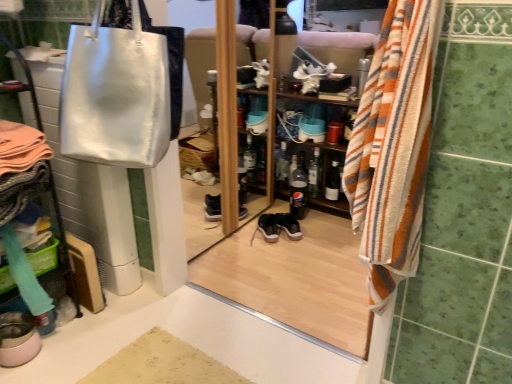
Question: Would you consider shiny silver bag at upper left to be distant from clear glass bottle at center, placed as the fourth bottle when sorted from right to left?

Choices:
 (A) no
 (B) yes

Answer: (B)

Question: Is shiny silver bag at upper left outside clear glass bottle at center, positioned as the 1th bottle in left-to-right order?

Choices:
 (A) yes
 (B) no

Answer: (A)

Question: Could you tell me if shiny silver bag at upper left is turned towards clear glass bottle at center, positioned as the 1th bottle in left-to-right order?

Choices:
 (A) yes
 (B) no

Answer: (B)

Question: From the image's perspective, is shiny silver bag at upper left located above clear glass bottle at center, placed as the fourth bottle when sorted from right to left?

Choices:
 (A) no
 (B) yes

Answer: (B)

Question: Considering the relative positions of shiny silver bag at upper left and clear glass bottle at center, positioned as the 1th bottle in left-to-right order, in the image provided, is shiny silver bag at upper left to the left of clear glass bottle at center, positioned as the 1th bottle in left-to-right order, from the viewer's perspective?

Choices:
 (A) no
 (B) yes

Answer: (B)

Question: From a real-world perspective, is shiny silver bag at upper left over clear glass bottle at center, placed as the fourth bottle when sorted from right to left?

Choices:
 (A) yes
 (B) no

Answer: (A)

Question: Can you confirm if beige textured bath mat at lower center is shorter than striped cotton towel at right?

Choices:
 (A) yes
 (B) no

Answer: (A)

Question: Is the position of beige textured bath mat at lower center less distant than that of striped cotton towel at right?

Choices:
 (A) no
 (B) yes

Answer: (A)

Question: Is beige textured bath mat at lower center located outside striped cotton towel at right?

Choices:
 (A) yes
 (B) no

Answer: (A)

Question: Is the position of beige textured bath mat at lower center more distant than that of striped cotton towel at right?

Choices:
 (A) no
 (B) yes

Answer: (B)

Question: Would you consider beige textured bath mat at lower center to be distant from striped cotton towel at right?

Choices:
 (A) no
 (B) yes

Answer: (A)

Question: Could you tell me if beige textured bath mat at lower center is facing striped cotton towel at right?

Choices:
 (A) yes
 (B) no

Answer: (B)

Question: Is matte silver bag at upper left bigger than black glass bottle at center, the fourth bottle when ordered from left to right?

Choices:
 (A) yes
 (B) no

Answer: (A)